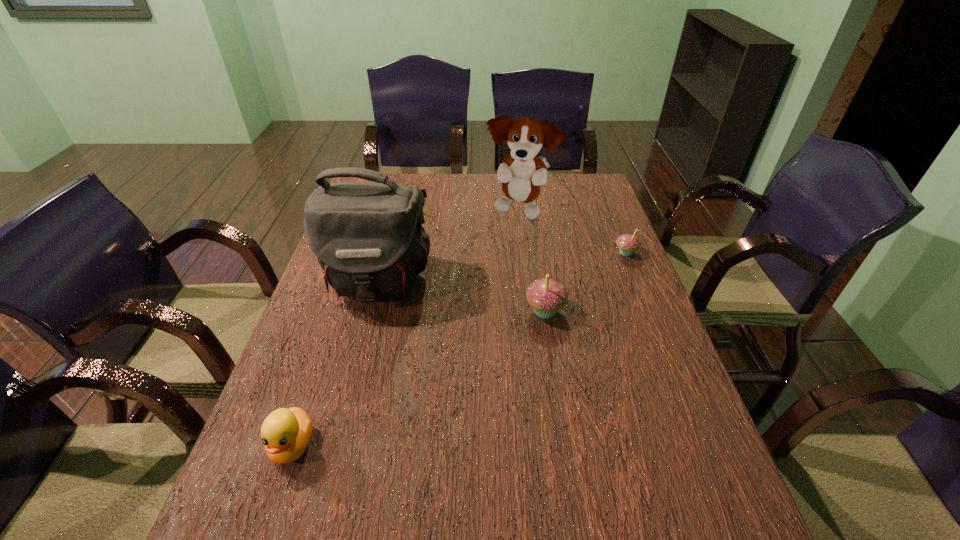
The image size is (960, 540). I want to click on free space located on the back of the shortest object, so click(420, 197).

Where is `vacant area situated on the face of the puppy`? The width and height of the screenshot is (960, 540). vacant area situated on the face of the puppy is located at coordinates (524, 252).

Find the location of a particular element. This screenshot has height=540, width=960. vacant area situated on the open flap of the shoulder bag is located at coordinates (341, 418).

This screenshot has width=960, height=540. Identify the location of pocket watch that is at the far edge. (438, 210).

The width and height of the screenshot is (960, 540). I want to click on puppy that is at the far edge, so click(x=521, y=173).

At what (x,y) coordinates should I click in order to perform the action: click on object that is at the near edge. Please return your answer as a coordinate pair (x, y). Image resolution: width=960 pixels, height=540 pixels. Looking at the image, I should click on (286, 433).

Identify the location of pocket watch that is at the left edge. (438, 210).

At what (x,y) coordinates should I click in order to perform the action: click on shoulder bag positioned at the left edge. Please return your answer as a coordinate pair (x, y). The height and width of the screenshot is (540, 960). Looking at the image, I should click on (368, 237).

I want to click on duckling that is at the left edge, so click(x=286, y=433).

The height and width of the screenshot is (540, 960). I want to click on object situated at the right edge, so click(x=628, y=244).